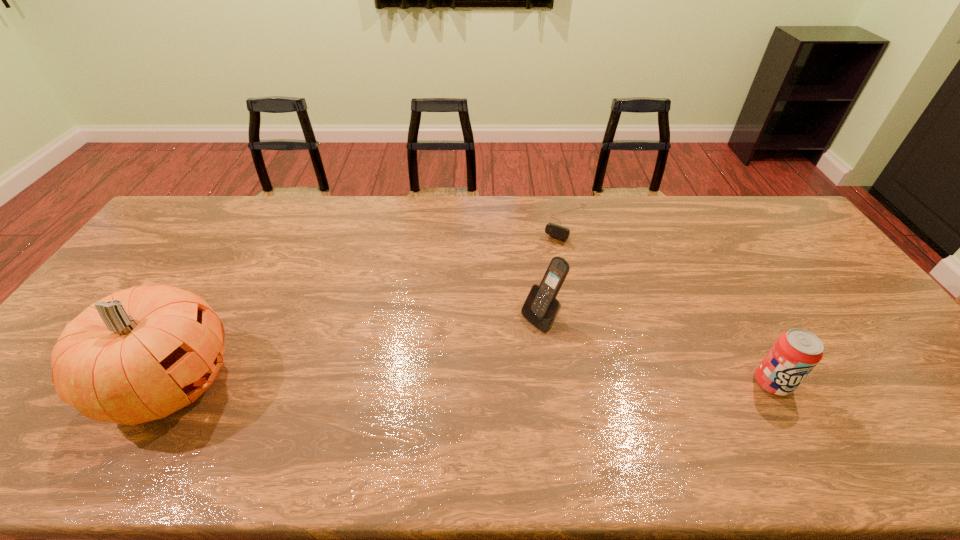
Identify the location of vacant space on the desktop that is between the pumpkin and the soda can and is positioned on the front-facing side of the shortest object. (450, 383).

Where is `vacant space on the desktop that is between the pumpkin and the soda can and is positioned on the front-facing side of the cellular telephone`? The width and height of the screenshot is (960, 540). vacant space on the desktop that is between the pumpkin and the soda can and is positioned on the front-facing side of the cellular telephone is located at coordinates (449, 383).